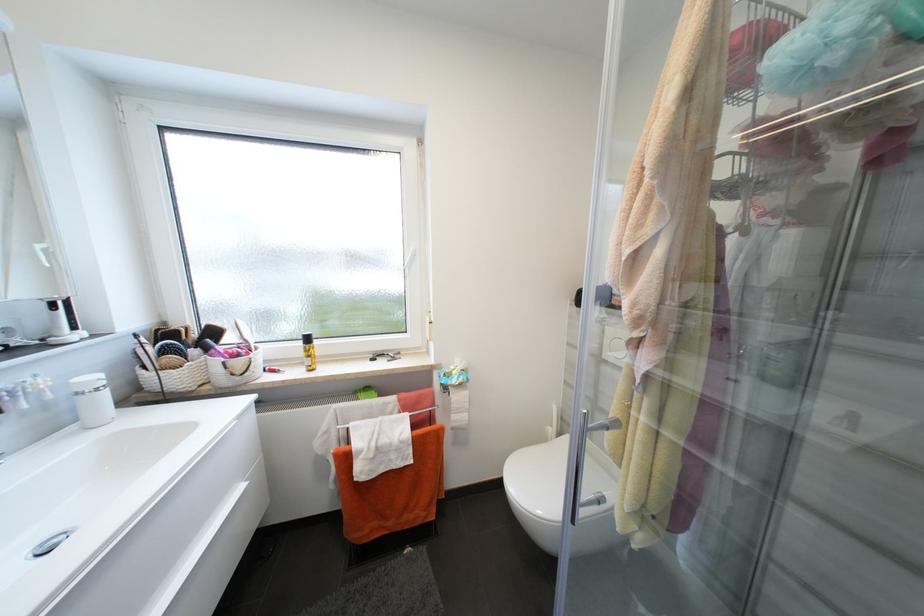
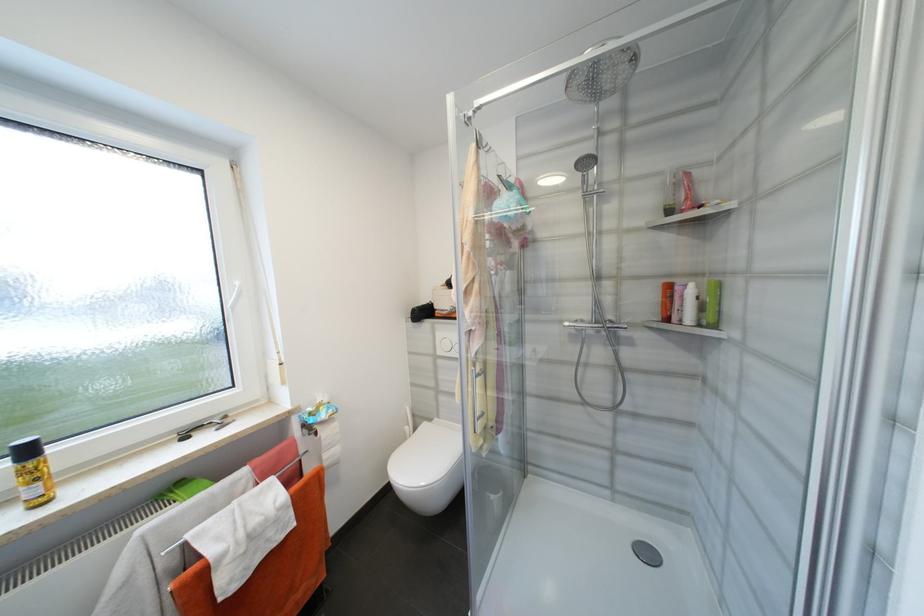
Where in the second image is the point corresponding to pixel 313 341 from the first image?

(33, 453)